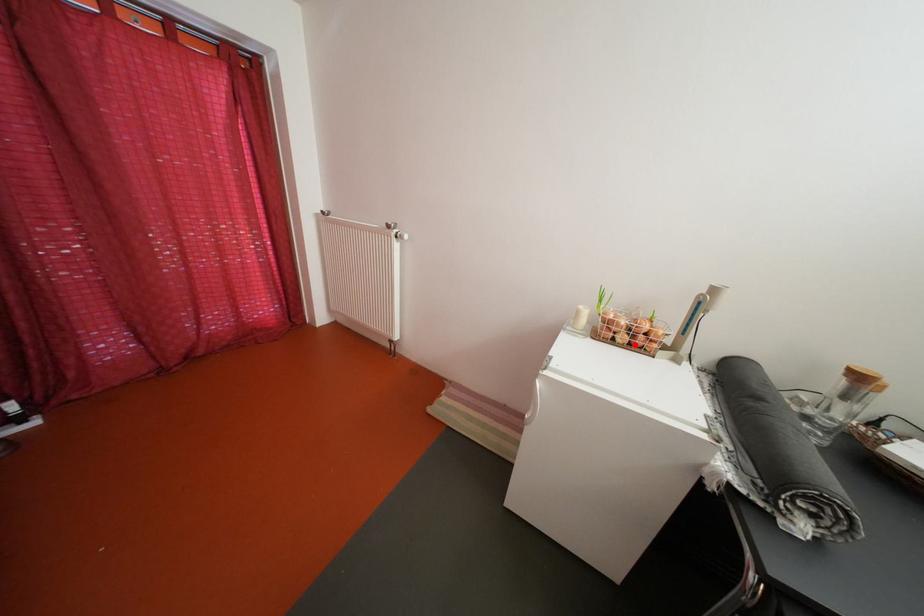
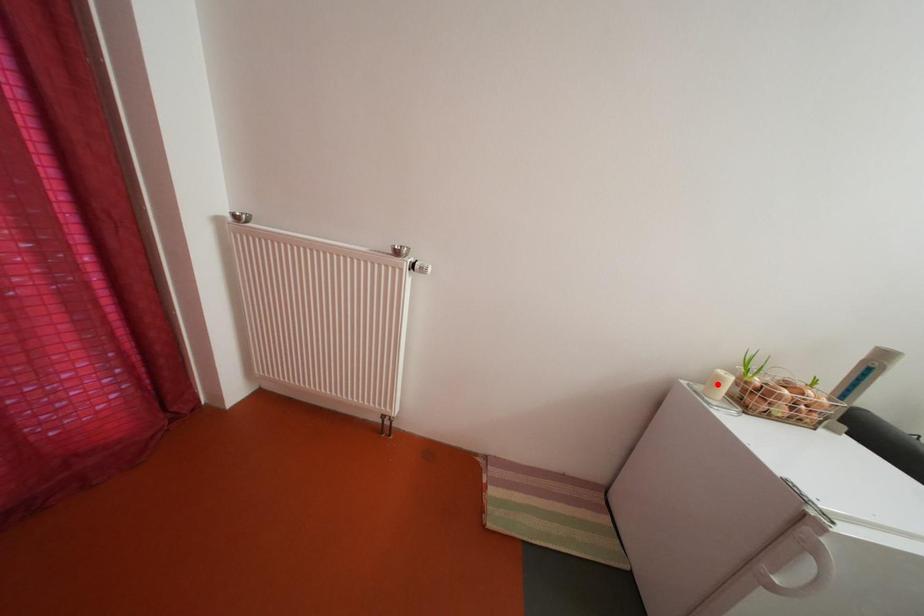
I am providing you with two images of the same scene from different viewpoints. A red point is marked on the first image and another point is marked on the second image. Is the marked point in image1 the same physical position as the marked point in image2?

No